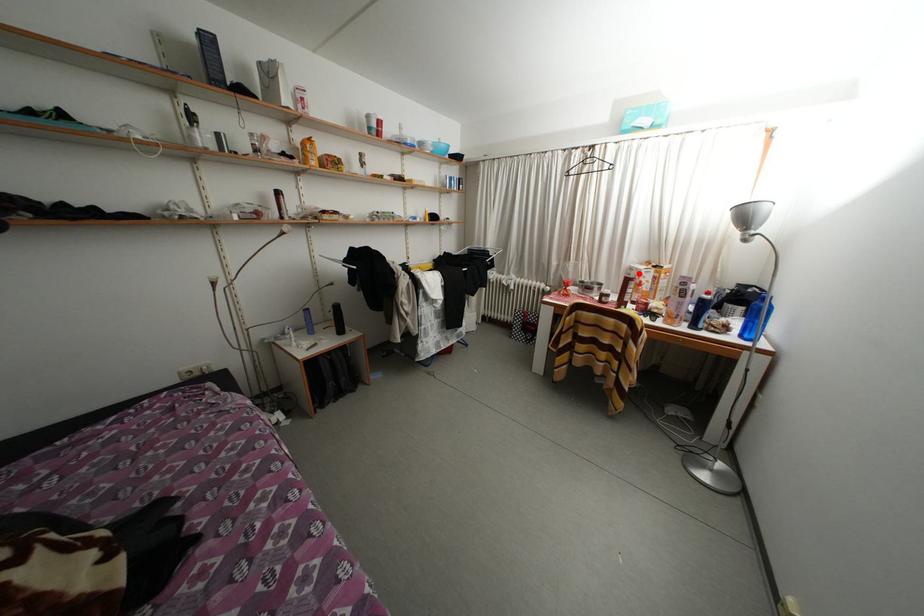
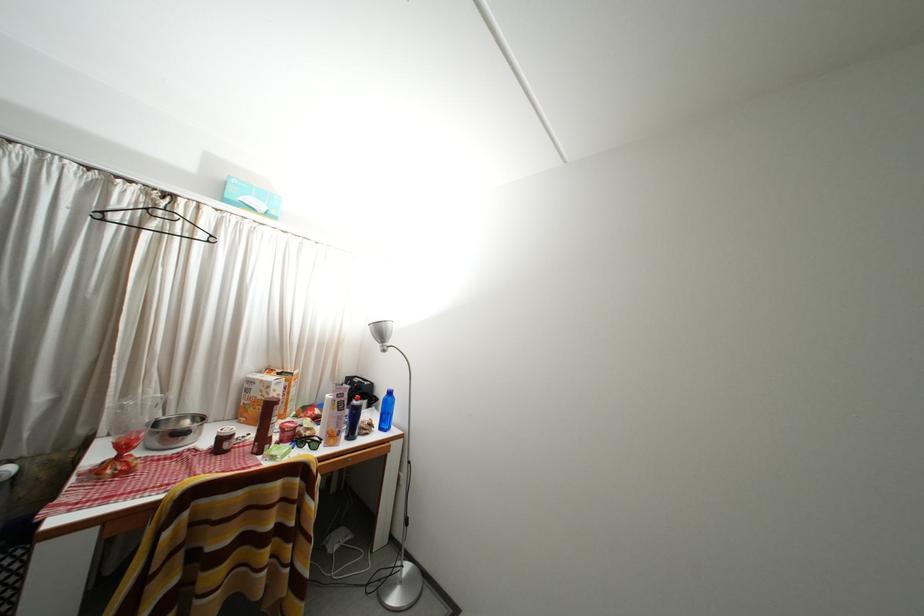
Question: I am providing you with two images of the same scene from different viewpoints. A red point is marked on the first image. Is the red point's position out of view in image 2?

Choices:
 (A) Yes
 (B) No

Answer: (B)